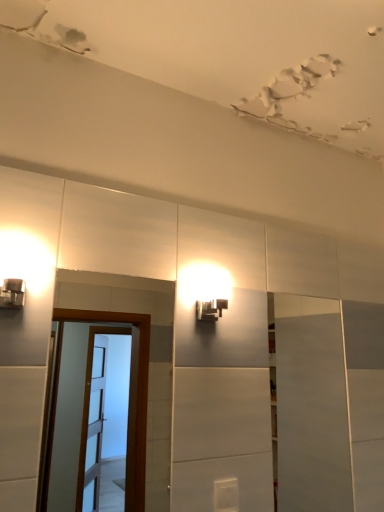
The width and height of the screenshot is (384, 512). What do you see at coordinates (311, 406) in the screenshot?
I see `white glossy door at right` at bounding box center [311, 406].

Locate an element on the screen. The width and height of the screenshot is (384, 512). white plastic light switch at lower center is located at coordinates (226, 495).

The height and width of the screenshot is (512, 384). I want to click on brown wooden screen door at left, so click(x=129, y=400).

Based on the photo, which object is positioned more to the left, matte black light fixture at upper center or white glossy door at right?

From the viewer's perspective, matte black light fixture at upper center appears more on the left side.

This screenshot has height=512, width=384. What are the coordinates of `door located on the right of matte black light fixture at upper center` in the screenshot? It's located at (311, 406).

How many degrees apart are the facing directions of matte black light fixture at upper center and white glossy door at right?

The angle between the facing direction of matte black light fixture at upper center and the facing direction of white glossy door at right is 1.56 degrees.

In the scene shown: Is white glossy door at right inside matte black light fixture at upper center?

No, white glossy door at right is located outside of matte black light fixture at upper center.

Who is bigger, white plastic light switch at lower center or white glossy door at right?

Bigger between the two is white glossy door at right.

Is white plastic light switch at lower center directly adjacent to white glossy door at right?

They are not placed beside each other.

Is white plastic light switch at lower center oriented towards white glossy door at right?

No, white plastic light switch at lower center is not facing towards white glossy door at right.

Can you tell me how much white plastic light switch at lower center and white glossy door at right differ in facing direction?

1.19 degrees.

Is white glossy door at right in front of or behind brown wooden screen door at left in the image?

Clearly, white glossy door at right is behind brown wooden screen door at left.

Would you say white glossy door at right is a long distance from brown wooden screen door at left?

Indeed, white glossy door at right is not near brown wooden screen door at left.

Considering the sizes of white glossy door at right and brown wooden screen door at left in the image, is white glossy door at right taller or shorter than brown wooden screen door at left?

Considering their sizes, white glossy door at right has more height than brown wooden screen door at left.

Measure the distance from white glossy door at right to brown wooden screen door at left.

white glossy door at right and brown wooden screen door at left are 1.22 meters apart.

Looking at this image, based on their sizes in the image, would you say white plastic light switch at lower center is bigger or smaller than brown wooden screen door at left?

Considering their sizes, white plastic light switch at lower center takes up less space than brown wooden screen door at left.

The image size is (384, 512). Identify the location of light switch located on the right of brown wooden screen door at left. (226, 495).

Can brown wooden screen door at left be found inside white plastic light switch at lower center?

No.

From a real-world perspective, who is located higher, brown wooden screen door at left or white glossy door at right?

From a 3D spatial view, brown wooden screen door at left is above.

Is brown wooden screen door at left not inside white glossy door at right?

Absolutely, brown wooden screen door at left is external to white glossy door at right.

Looking at this image, can you tell me how much brown wooden screen door at left and white glossy door at right differ in facing direction?

1.85 degrees separate the facing orientations of brown wooden screen door at left and white glossy door at right.

From the image's perspective, is brown wooden screen door at left located above or below white glossy door at right?

From the image's perspective, brown wooden screen door at left appears above white glossy door at right.

Based on the photo, is matte black light fixture at upper center taller or shorter than brown wooden screen door at left?

Considering their sizes, matte black light fixture at upper center has less height than brown wooden screen door at left.

Which is behind, matte black light fixture at upper center or brown wooden screen door at left?

matte black light fixture at upper center.

The height and width of the screenshot is (512, 384). There is a brown wooden screen door at left. In order to click on light fixture above it (from a real-world perspective) in this screenshot , I will do `click(205, 290)`.

Is brown wooden screen door at left inside or outside of matte black light fixture at upper center?

brown wooden screen door at left is not inside matte black light fixture at upper center, it's outside.

In order to click on light fixture behind the brown wooden screen door at left in this screenshot , I will do `click(205, 290)`.

Can you see brown wooden screen door at left touching matte black light fixture at upper center?

brown wooden screen door at left and matte black light fixture at upper center are not in contact.

Locate an element on the screen. The image size is (384, 512). light fixture above the white glossy door at right (from the image's perspective) is located at coordinates (205, 290).

Locate an element on the screen. door behind the white plastic light switch at lower center is located at coordinates (311, 406).

Considering their positions, is brown wooden screen door at left positioned closer to matte black light fixture at upper center than white glossy door at right?

white glossy door at right is positioned closer to the anchor matte black light fixture at upper center.

Estimate the real-world distances between objects in this image. Which object is closer to white plastic light switch at lower center, matte black light fixture at upper center or white glossy door at right?

matte black light fixture at upper center.

When comparing their distances from brown wooden screen door at left, does white plastic light switch at lower center or matte black light fixture at upper center seem further?

white plastic light switch at lower center is positioned further to the anchor brown wooden screen door at left.

Considering their positions, is white glossy door at right positioned further to brown wooden screen door at left than matte black light fixture at upper center?

matte black light fixture at upper center is further to brown wooden screen door at left.

When comparing their distances from matte black light fixture at upper center, does white plastic light switch at lower center or brown wooden screen door at left seem closer?

The object closer to matte black light fixture at upper center is white plastic light switch at lower center.

Looking at the image, which one is located further to white glossy door at right, white plastic light switch at lower center or matte black light fixture at upper center?

matte black light fixture at upper center.

Based on their spatial positions, is matte black light fixture at upper center or white plastic light switch at lower center closer to white glossy door at right?

Based on the image, white plastic light switch at lower center appears to be nearer to white glossy door at right.

Consider the image. Which object lies nearer to the anchor point matte black light fixture at upper center, brown wooden screen door at left or white plastic light switch at lower center?

Based on the image, white plastic light switch at lower center appears to be nearer to matte black light fixture at upper center.

Find the location of `light fixture between brown wooden screen door at left and white glossy door at right`. light fixture between brown wooden screen door at left and white glossy door at right is located at coordinates (205, 290).

This screenshot has width=384, height=512. What are the coordinates of `light switch between brown wooden screen door at left and white glossy door at right` in the screenshot? It's located at (226, 495).

Identify the location of door between matte black light fixture at upper center and white plastic light switch at lower center in the vertical direction. (311, 406).

Find the location of a particular element. The image size is (384, 512). screen door between matte black light fixture at upper center and white plastic light switch at lower center vertically is located at coordinates (129, 400).